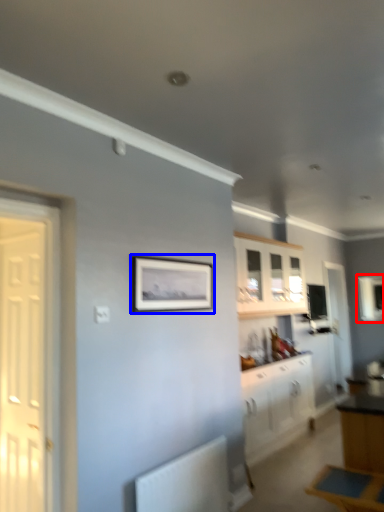
Question: Which point is closer to the camera, window (highlighted by a red box) or picture frame (highlighted by a blue box)?

Choices:
 (A) window
 (B) picture frame

Answer: (B)